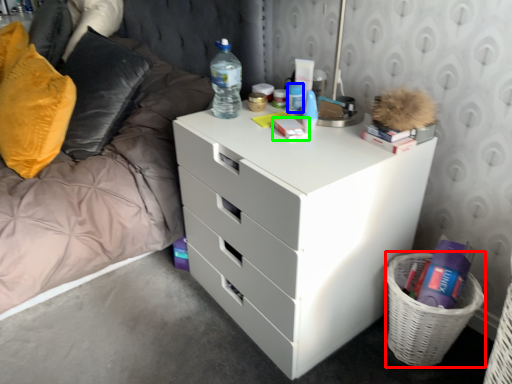
Question: Considering the real-world distances, which object is closest to basket (highlighted by a red box)? toiletry (highlighted by a blue box) or book (highlighted by a green box).

Choices:
 (A) toiletry
 (B) book

Answer: (B)